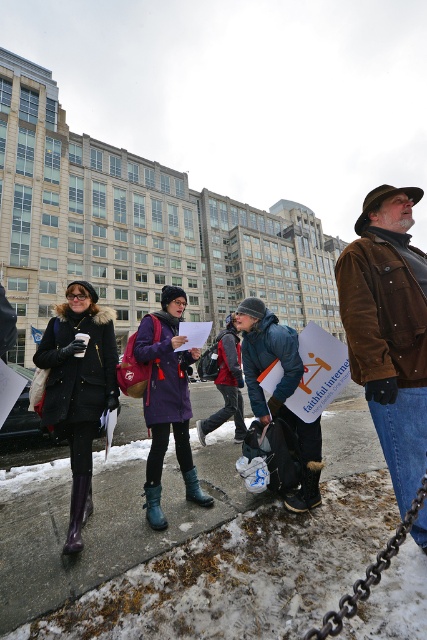
Based on the photo, is the position of brown suede jacket at right less distant than that of blue denim jacket at center?

Yes.

This screenshot has width=427, height=640. I want to click on brown suede jacket at right, so click(x=388, y=330).

Who is higher up, purple matte coat at center or blue denim jacket at center?

purple matte coat at center is higher up.

Is purple matte coat at center bigger than blue denim jacket at center?

Yes.

At what (x,y) coordinates should I click in order to perform the action: click on purple matte coat at center. Please return your answer as a coordinate pair (x, y). This screenshot has width=427, height=640. Looking at the image, I should click on (166, 401).

Can you confirm if purple matte coat at center is bigger than black metal chain at lower right?

Yes, purple matte coat at center is bigger than black metal chain at lower right.

Who is shorter, purple matte coat at center or black metal chain at lower right?

With less height is black metal chain at lower right.

Locate an element on the screen. purple matte coat at center is located at coordinates (166, 401).